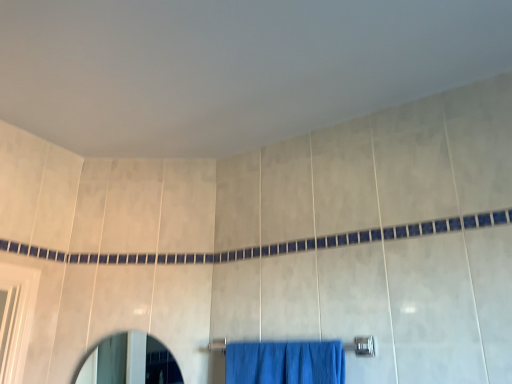
Question: Is matte glass mirror at lower left inside or outside of silver metallic towel bar at lower center?

Choices:
 (A) inside
 (B) outside

Answer: (B)

Question: Is matte glass mirror at lower left to the left or to the right of silver metallic towel bar at lower center in the image?

Choices:
 (A) right
 (B) left

Answer: (B)

Question: Considering their positions, is matte glass mirror at lower left located in front of or behind silver metallic towel bar at lower center?

Choices:
 (A) front
 (B) behind

Answer: (B)

Question: From a real-world perspective, relative to matte glass mirror at lower left, is silver metallic towel bar at lower center vertically above or below?

Choices:
 (A) above
 (B) below

Answer: (A)

Question: Looking at their shapes, would you say silver metallic towel bar at lower center is wider or thinner than matte glass mirror at lower left?

Choices:
 (A) thin
 (B) wide

Answer: (B)

Question: From the image's perspective, is silver metallic towel bar at lower center positioned above or below matte glass mirror at lower left?

Choices:
 (A) below
 (B) above

Answer: (B)

Question: Considering the positions of silver metallic towel bar at lower center and matte glass mirror at lower left in the image, is silver metallic towel bar at lower center bigger or smaller than matte glass mirror at lower left?

Choices:
 (A) small
 (B) big

Answer: (A)